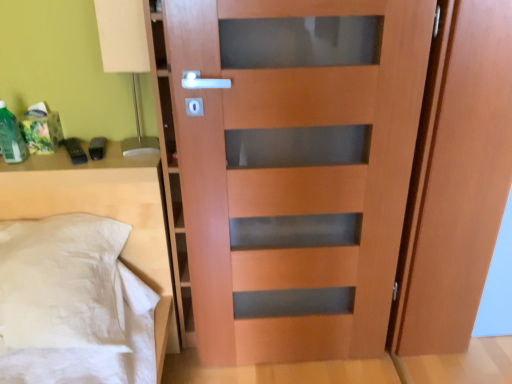
Question: Looking at the image, does green matte bottle at left seem bigger or smaller compared to white fabric pillow at left?

Choices:
 (A) small
 (B) big

Answer: (A)

Question: Considering the positions of green matte bottle at left and white fabric pillow at left in the image, is green matte bottle at left taller or shorter than white fabric pillow at left?

Choices:
 (A) short
 (B) tall

Answer: (A)

Question: Based on their relative distances, which object is farther from the transparent glass door at right?

Choices:
 (A) matte wood screen door at right
 (B) matte wood door at center
 (C) white matte table lamp at upper left
 (D) white fabric pillow at left
 (E) green matte bottle at left

Answer: (E)

Question: Which object is the closest to the matte wood door at center?

Choices:
 (A) transparent glass door at right
 (B) green matte bottle at left
 (C) white matte table lamp at upper left
 (D) matte wood screen door at right
 (E) white fabric pillow at left

Answer: (D)